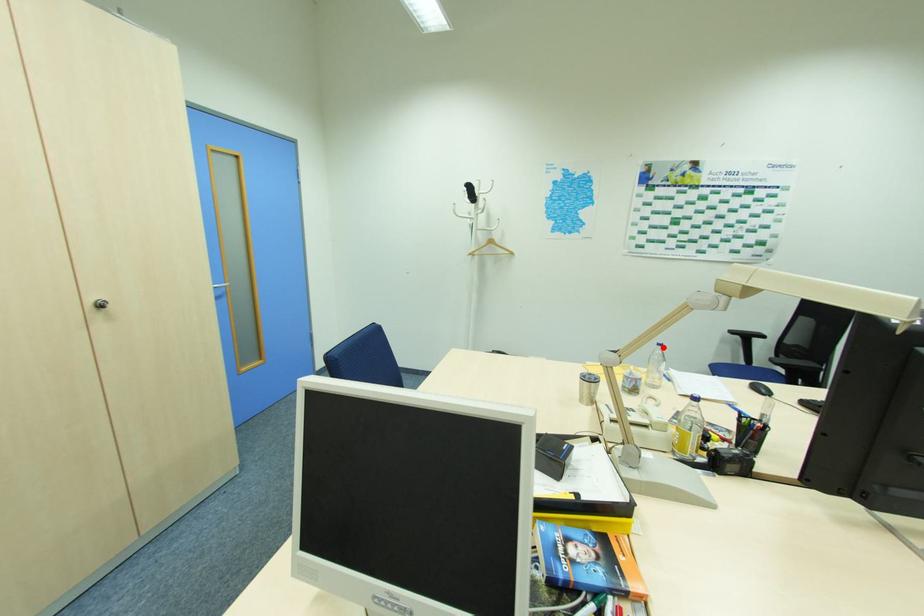
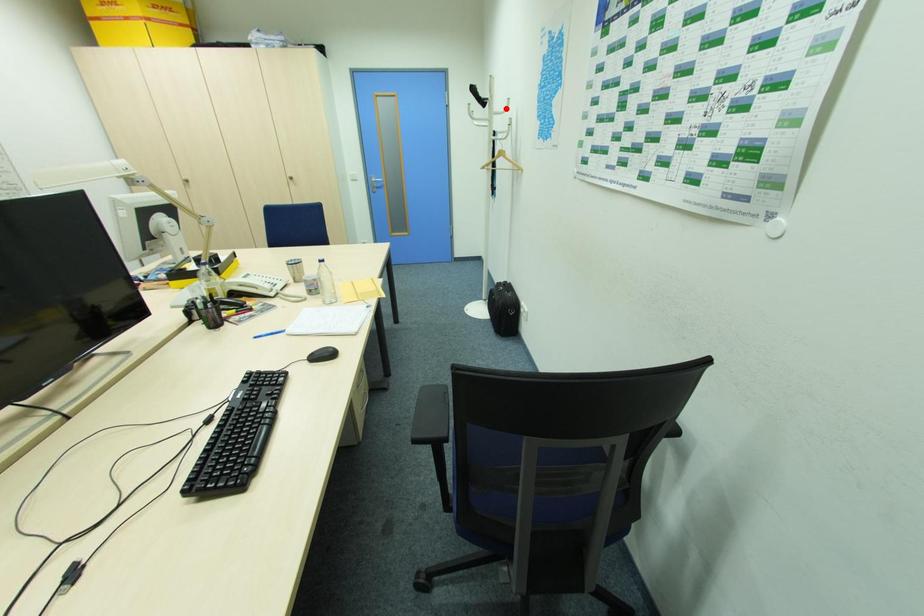
I am providing you with two images of the same scene from different viewpoints. A red point is marked on the first image and another point is marked on the second image. Is the red point in image1 aligned with the point shown in image2?

No